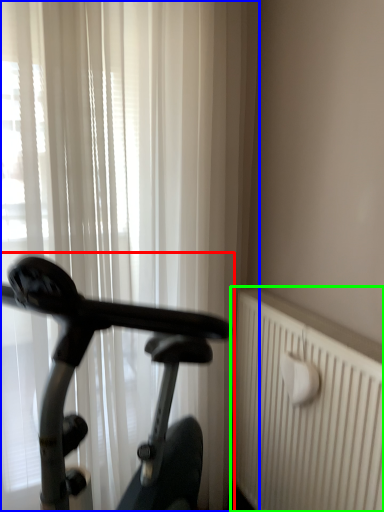
Question: Based on their relative distances, which object is nearer to bicycle (highlighted by a red box)? Choose from curtain (highlighted by a blue box) and radiator (highlighted by a green box).

Choices:
 (A) curtain
 (B) radiator

Answer: (B)